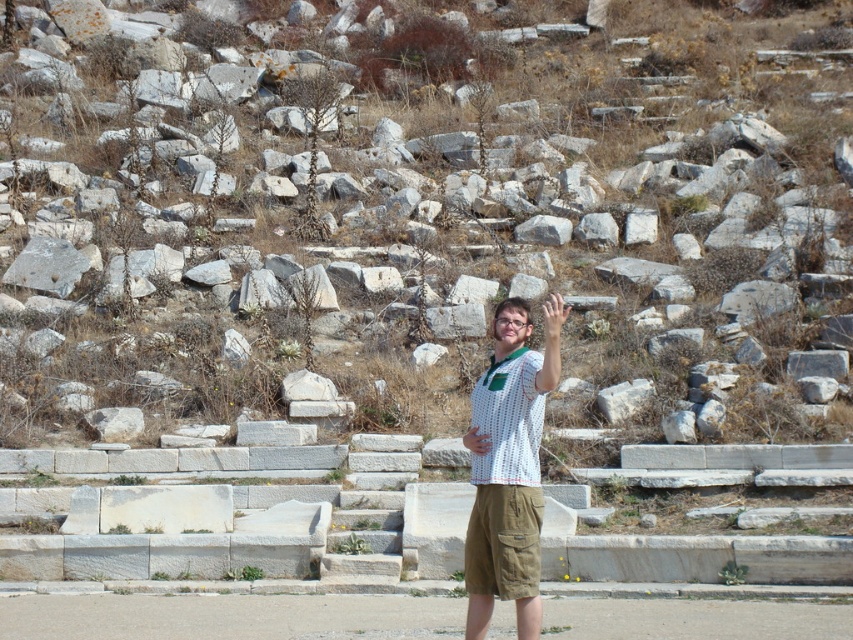
You are a fashion designer observing a person wearing a white dotted shirt at center and khaki cotton shorts at center. Which clothing item appears to be smaller in size?

The white dotted shirt at center has a smaller size compared to the khaki cotton shorts at center, so the white dotted shirt at center is the smaller one.

You are a photographer trying to capture the best shot of the archaeological site. You notice two points marked in the image. The first point is at coordinates point (231, 172), and the second is at point (517, 419). Which of these points is closer to the camera?

Point (231, 172) is further to the camera than point (517, 419), so the point closer to the camera is point (517, 419).

You are standing in an archaeological site and see the white stone steps at center and the khaki cotton shorts at center. Which object is positioned to the left?

The white stone steps at center is to the left of khaki cotton shorts at center, so the white stone steps at center is positioned to the left.